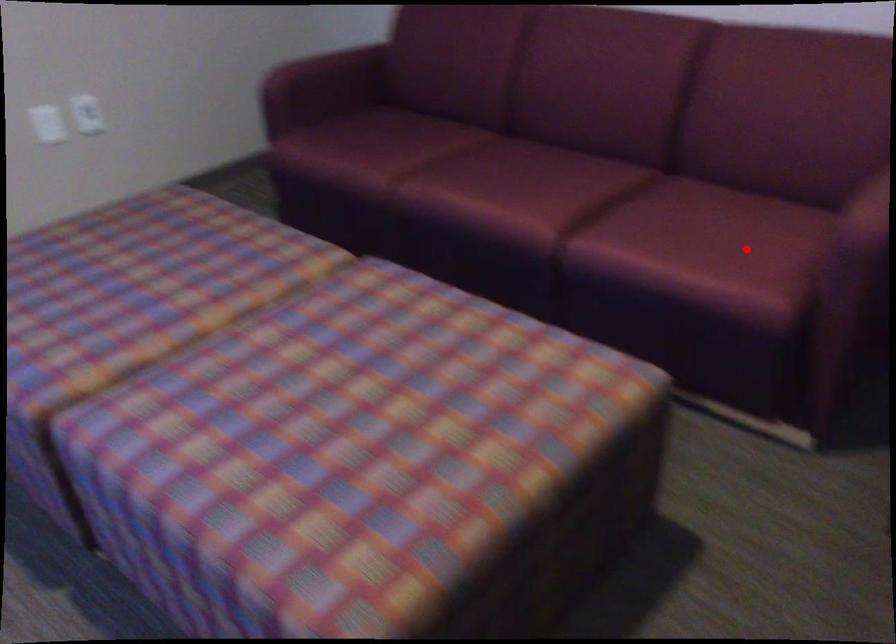
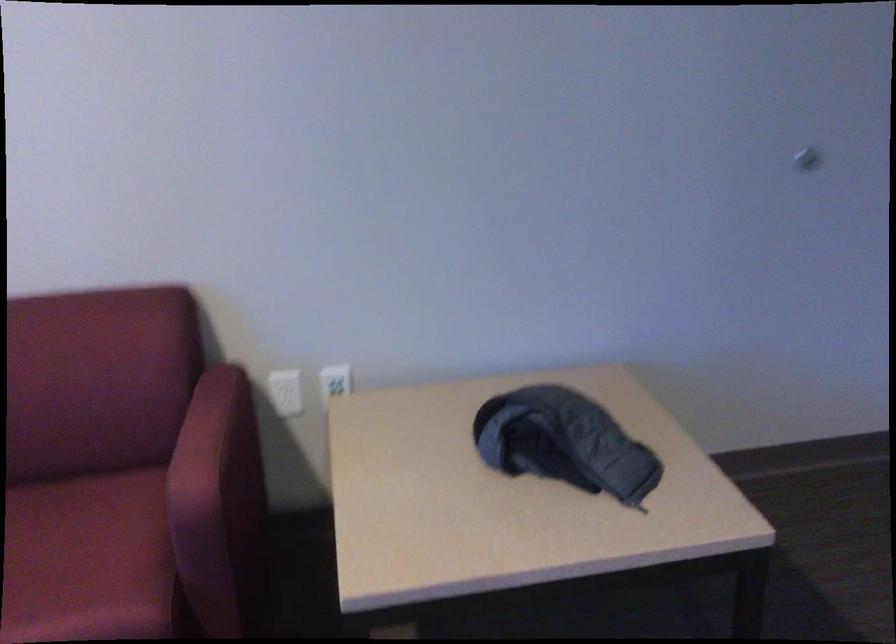
Where in the second image is the point corresponding to the highlighted location from the first image?

(88, 560)